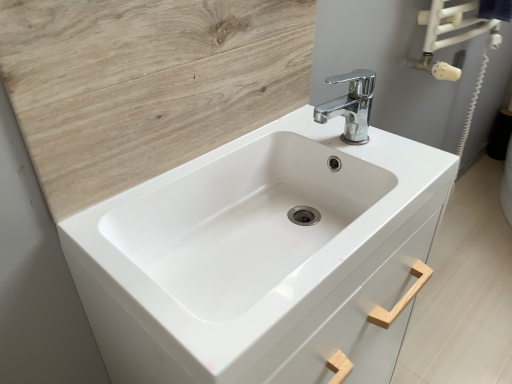
Find the location of a particular element. The height and width of the screenshot is (384, 512). vacant space in front of chrome metallic faucet at upper center is located at coordinates (389, 172).